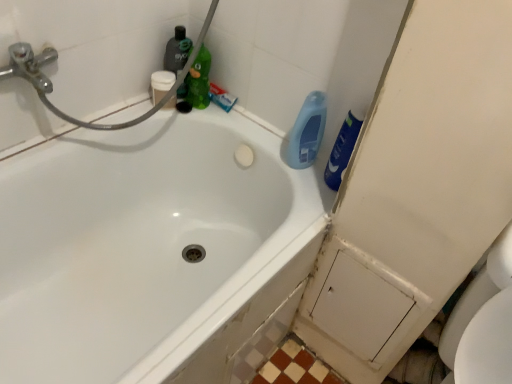
Where is `green matte bottle at upper center, which is the 2th cleaning product from left to right`? This screenshot has height=384, width=512. green matte bottle at upper center, which is the 2th cleaning product from left to right is located at coordinates (199, 80).

Measure the distance between point (x=54, y=352) and camera.

Point (x=54, y=352) and camera are 1.05 meters apart from each other.

The image size is (512, 384). What do you see at coordinates (151, 252) in the screenshot? I see `white glossy bathtub at upper left` at bounding box center [151, 252].

What is the approximate height of blue matte toothpaste at upper center?

4.20 centimeters.

Where is `white matte cup at upper left`? white matte cup at upper left is located at coordinates (161, 84).

What do you see at coordinates (161, 84) in the screenshot? I see `white matte cup at upper left` at bounding box center [161, 84].

The image size is (512, 384). I want to click on green matte bottle at upper center, which is the 2th cleaning product from left to right, so click(199, 80).

Is green matte bottle at upper center, the third cleaning product from the right, looking in the opposite direction of white glossy bathtub at upper left?

No, green matte bottle at upper center, the third cleaning product from the right,'s orientation is not away from white glossy bathtub at upper left.

Is the depth of green matte bottle at upper center, the third cleaning product from the right, less than that of white glossy bathtub at upper left?

No, green matte bottle at upper center, the third cleaning product from the right, is further to the viewer.

Which is in front, point (208, 79) or point (278, 224)?

Positioned in front is point (278, 224).

Is green matte bottle at upper center, the third cleaning product from the right, positioned behind translucent green bottle at upper center, marked as the first cleaning product in a left-to-right arrangement?

No.

From a real-world perspective, does green matte bottle at upper center, the third cleaning product from the right, stand above translucent green bottle at upper center, the fourth cleaning product from the right?

No, from a real-world perspective, green matte bottle at upper center, the third cleaning product from the right, is not above translucent green bottle at upper center, the fourth cleaning product from the right.

Based on the photo, is green matte bottle at upper center, the third cleaning product from the right, surrounding translucent green bottle at upper center, the fourth cleaning product from the right?

Definitely not — translucent green bottle at upper center, the fourth cleaning product from the right, is not inside green matte bottle at upper center, the third cleaning product from the right.

Based on their sizes in the image, would you say blue glossy bottle at upper right, which appears as the third cleaning product when viewed from the left, is bigger or smaller than green matte bottle at upper center, which is the 2th cleaning product from left to right?

blue glossy bottle at upper right, which appears as the third cleaning product when viewed from the left, is bigger than green matte bottle at upper center, which is the 2th cleaning product from left to right.

Does point (301, 158) appear closer or farther from the camera than point (206, 86)?

Point (301, 158).

Is blue glossy bottle at upper right, which appears as the third cleaning product when viewed from the left, positioned with its back to green matte bottle at upper center, the third cleaning product from the right?

Yes.

Which object is further away from the camera, blue glossy bottle at upper right, which appears as the third cleaning product when viewed from the left, or green matte bottle at upper center, which is the 2th cleaning product from left to right?

green matte bottle at upper center, which is the 2th cleaning product from left to right, is further from the camera.

Can you confirm if blue glossy bottle at upper right, which appears as the third cleaning product when viewed from the left, is thinner than translucent green bottle at upper center, marked as the first cleaning product in a left-to-right arrangement?

Incorrect, the width of blue glossy bottle at upper right, which appears as the third cleaning product when viewed from the left, is not less than that of translucent green bottle at upper center, marked as the first cleaning product in a left-to-right arrangement.

From the image's perspective, which object appears higher, blue glossy bottle at upper right, which appears as the third cleaning product when viewed from the left, or translucent green bottle at upper center, marked as the first cleaning product in a left-to-right arrangement?

translucent green bottle at upper center, marked as the first cleaning product in a left-to-right arrangement, appears higher in the image.

From a real-world perspective, is blue glossy bottle at upper right, marked as the 2th cleaning product in a right-to-left arrangement, below translucent green bottle at upper center, marked as the first cleaning product in a left-to-right arrangement?

No, from a real-world perspective, blue glossy bottle at upper right, marked as the 2th cleaning product in a right-to-left arrangement, is not beneath translucent green bottle at upper center, marked as the first cleaning product in a left-to-right arrangement.

Is white glossy bathtub at upper left next to blue matte toothpaste at upper center and touching it?

No, white glossy bathtub at upper left is not making contact with blue matte toothpaste at upper center.

Is point (60, 245) closer or farther from the camera than point (230, 99)?

Point (60, 245).

Looking at their sizes, would you say white glossy bathtub at upper left is wider or thinner than blue matte toothpaste at upper center?

Considering their sizes, white glossy bathtub at upper left looks broader than blue matte toothpaste at upper center.

From the image's perspective, between white glossy bathtub at upper left and blue matte toothpaste at upper center, who is located below?

white glossy bathtub at upper left is shown below in the image.

Between blue glossy bottle at upper right, acting as the 4th cleaning product starting from the left, and translucent green bottle at upper center, the fourth cleaning product from the right, which one appears on the right side from the viewer's perspective?

Positioned to the right is blue glossy bottle at upper right, acting as the 4th cleaning product starting from the left.

Is blue glossy bottle at upper right, the first cleaning product from the right, positioned beyond the bounds of translucent green bottle at upper center, marked as the first cleaning product in a left-to-right arrangement?

Indeed, blue glossy bottle at upper right, the first cleaning product from the right, is completely outside translucent green bottle at upper center, marked as the first cleaning product in a left-to-right arrangement.

From the image's perspective, is blue glossy bottle at upper right, acting as the 4th cleaning product starting from the left, on translucent green bottle at upper center, the fourth cleaning product from the right?

No.

Can we say blue glossy bottle at upper right, the first cleaning product from the right, lies outside blue glossy bottle at upper right, which appears as the third cleaning product when viewed from the left?

Yes, blue glossy bottle at upper right, the first cleaning product from the right, is located beyond the bounds of blue glossy bottle at upper right, which appears as the third cleaning product when viewed from the left.

Measure the distance from blue glossy bottle at upper right, the first cleaning product from the right, to blue glossy bottle at upper right, which appears as the third cleaning product when viewed from the left.

The distance of blue glossy bottle at upper right, the first cleaning product from the right, from blue glossy bottle at upper right, which appears as the third cleaning product when viewed from the left, is 3.22 inches.

From the picture: Is blue glossy bottle at upper right, the first cleaning product from the right, to the left or to the right of blue glossy bottle at upper right, marked as the 2th cleaning product in a right-to-left arrangement, in the image?

blue glossy bottle at upper right, the first cleaning product from the right, is positioned on blue glossy bottle at upper right, marked as the 2th cleaning product in a right-to-left arrangement,'s right side.

From the image's perspective, does blue glossy bottle at upper right, acting as the 4th cleaning product starting from the left, appear lower than blue glossy bottle at upper right, which appears as the third cleaning product when viewed from the left?

Correct, blue glossy bottle at upper right, acting as the 4th cleaning product starting from the left, appears lower than blue glossy bottle at upper right, which appears as the third cleaning product when viewed from the left, in the image.

Locate an element on the screen. The image size is (512, 384). the 3rd cleaning product behind the white glossy bathtub at upper left is located at coordinates (199, 80).

From the translucent green bottle at upper center, the fourth cleaning product from the right, count 1st cleaning products forward and point to it. Please provide its 2D coordinates.

[(199, 80)]

When comparing their distances from white glossy bathtub at upper left, does white matte cup at upper left or blue matte toothpaste at upper center seem closer?

Among the two, white matte cup at upper left is located nearer to white glossy bathtub at upper left.

Based on the photo, considering their positions, is blue glossy bottle at upper right, marked as the 2th cleaning product in a right-to-left arrangement, positioned further to green matte bottle at upper center, the third cleaning product from the right, than translucent green bottle at upper center, marked as the first cleaning product in a left-to-right arrangement?

blue glossy bottle at upper right, marked as the 2th cleaning product in a right-to-left arrangement, is further to green matte bottle at upper center, the third cleaning product from the right.

Looking at the image, which one is located further to blue matte toothpaste at upper center, blue glossy bottle at upper right, which appears as the third cleaning product when viewed from the left, or white matte cup at upper left?

Based on the image, blue glossy bottle at upper right, which appears as the third cleaning product when viewed from the left, appears to be further to blue matte toothpaste at upper center.

Looking at this image, from the image, which object appears to be nearer to blue glossy bottle at upper right, marked as the 2th cleaning product in a right-to-left arrangement, translucent green bottle at upper center, marked as the first cleaning product in a left-to-right arrangement, or green matte bottle at upper center, which is the 2th cleaning product from left to right?

The object closer to blue glossy bottle at upper right, marked as the 2th cleaning product in a right-to-left arrangement, is green matte bottle at upper center, which is the 2th cleaning product from left to right.

When comparing their distances from blue glossy bottle at upper right, which appears as the third cleaning product when viewed from the left, does blue matte toothpaste at upper center or white glossy bathtub at upper left seem closer?

blue matte toothpaste at upper center is positioned closer to the anchor blue glossy bottle at upper right, which appears as the third cleaning product when viewed from the left.

From the image, which object appears to be nearer to green matte bottle at upper center, the third cleaning product from the right, white glossy bathtub at upper left or white matte cup at upper left?

white matte cup at upper left is closer to green matte bottle at upper center, the third cleaning product from the right.

From the image, which object appears to be farther from green matte bottle at upper center, the third cleaning product from the right, translucent green bottle at upper center, the fourth cleaning product from the right, or blue glossy bottle at upper right, acting as the 4th cleaning product starting from the left?

blue glossy bottle at upper right, acting as the 4th cleaning product starting from the left, is positioned further to the anchor green matte bottle at upper center, the third cleaning product from the right.

From the image, which object appears to be farther from white glossy bathtub at upper left, green matte bottle at upper center, the third cleaning product from the right, or translucent green bottle at upper center, marked as the first cleaning product in a left-to-right arrangement?

translucent green bottle at upper center, marked as the first cleaning product in a left-to-right arrangement, lies further to white glossy bathtub at upper left than the other object.

Identify the location of toiletry located between white glossy bathtub at upper left and blue matte toothpaste at upper center in the depth direction. The image size is (512, 384). (161, 84).

Identify the location of toothpaste between white matte cup at upper left and blue glossy bottle at upper right, which appears as the third cleaning product when viewed from the left, from left to right. (222, 97).

This screenshot has height=384, width=512. What are the coordinates of `toothpaste located between white matte cup at upper left and blue glossy bottle at upper right, the first cleaning product from the right, in the left-right direction` in the screenshot? It's located at (222, 97).

Where is `toothpaste between green matte bottle at upper center, the third cleaning product from the right, and blue glossy bottle at upper right, which appears as the third cleaning product when viewed from the left, from left to right`? toothpaste between green matte bottle at upper center, the third cleaning product from the right, and blue glossy bottle at upper right, which appears as the third cleaning product when viewed from the left, from left to right is located at coordinates (222, 97).